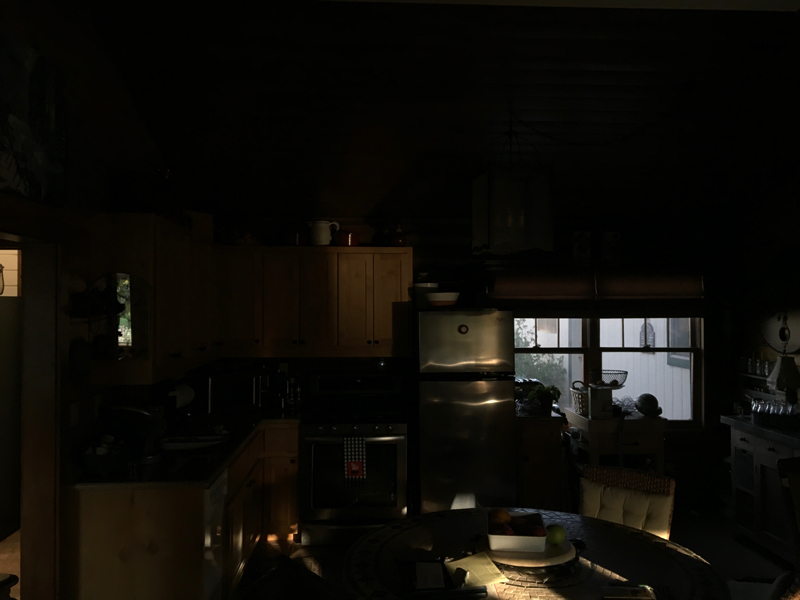
What are the coordinates of `large window panes` in the screenshot? It's located at (560, 364), (650, 367).